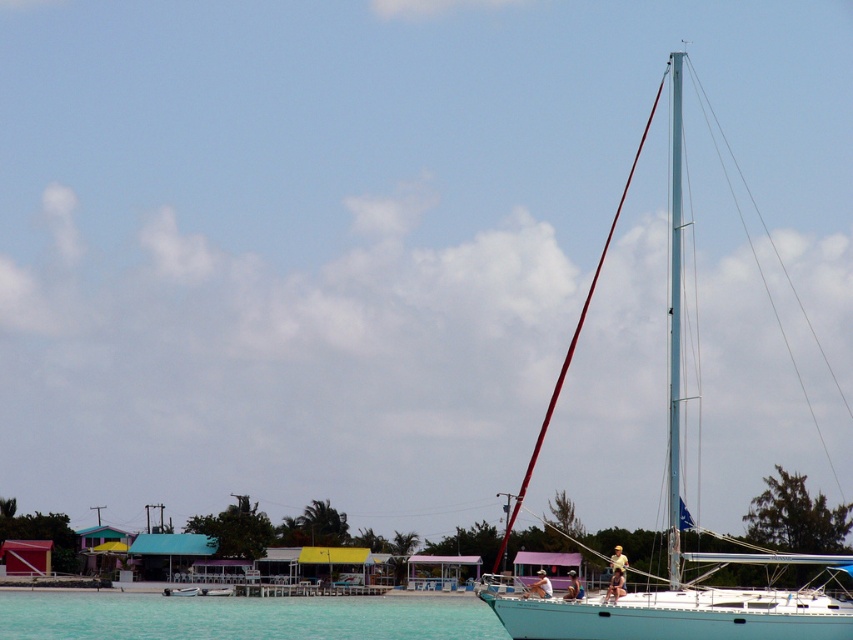
You are a photographer planning to capture the teal matte sailboat at right and the clear blue water at lower left in a single shot. Based on their sizes in the image, which object should you focus on first to ensure both are in frame?

The teal matte sailboat at right is bigger than the clear blue water at lower left, so focusing on the larger object first will help ensure both fit in the frame.

You are a photographer planning to take a photo of the teal matte sailboat at right and the clear blue water at lower left. Based on their heights, which object should you focus on first if you want to capture both in a single frame without adjusting your camera angle?

The teal matte sailboat at right is much taller than the clear blue water at lower left, so you should focus on the sailboat first to ensure its full height fits within the frame while still capturing the water.